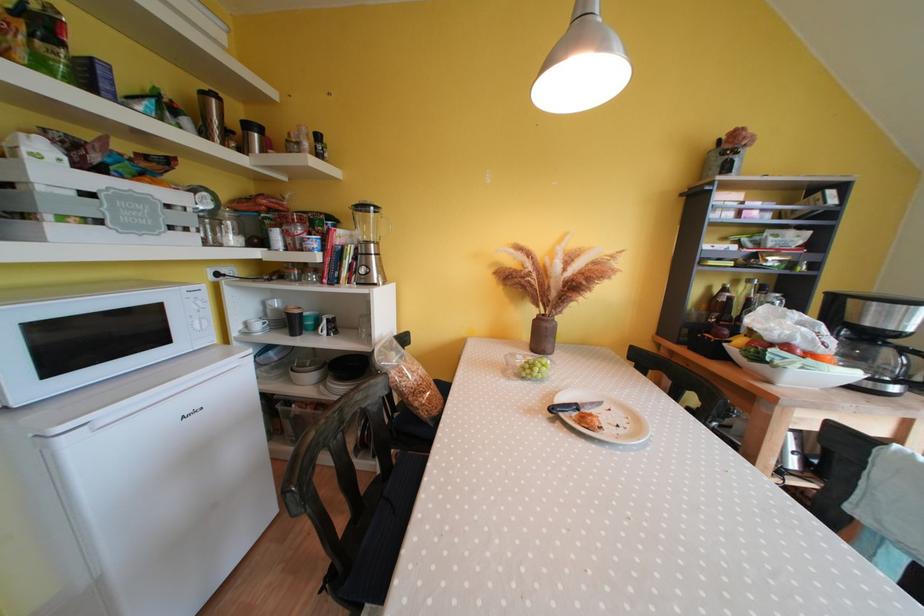
Which object does [368,244] point to?

It corresponds to the blender pitcher in the image.